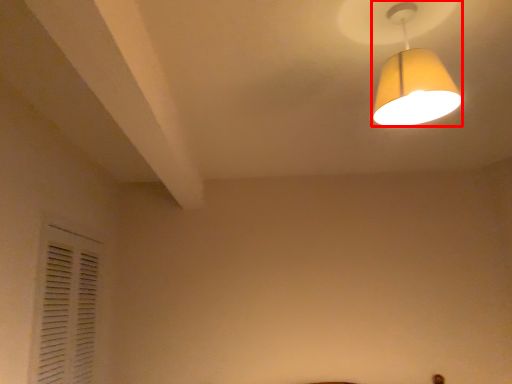
Question: From the image's perspective, where is lamp (annotated by the red box) located relative to shutter?

Choices:
 (A) below
 (B) above

Answer: (B)